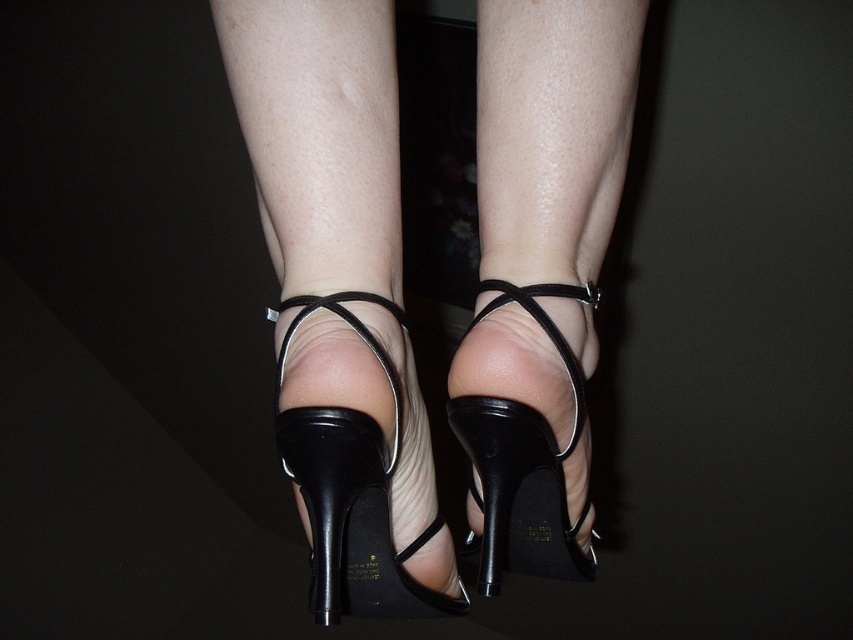
Question: Is black leather heels at center below black matte sandal at center?

Choices:
 (A) no
 (B) yes

Answer: (A)

Question: Is black matte sandal at center to the right of black leather high-heeled shoe at center from the viewer's perspective?

Choices:
 (A) no
 (B) yes

Answer: (A)

Question: Can you confirm if black leather heels at center is positioned above black leather high-heeled shoe at center?

Choices:
 (A) yes
 (B) no

Answer: (A)

Question: Which point appears farthest from the camera in this image?

Choices:
 (A) (320, 358)
 (B) (337, 586)

Answer: (B)

Question: Which is farther from the black leather high-heeled shoe at center?

Choices:
 (A) black leather heels at center
 (B) black matte sandal at center

Answer: (B)

Question: Which point is closer to the camera?

Choices:
 (A) (323, 10)
 (B) (482, 412)
 (C) (310, 525)

Answer: (A)